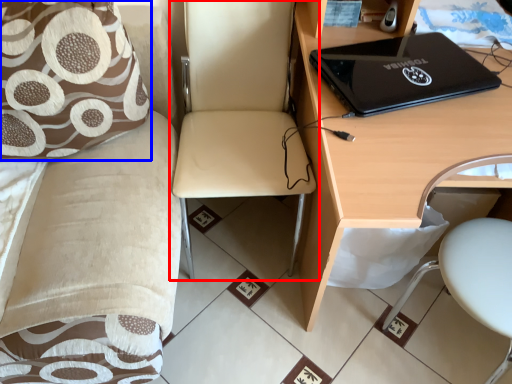
Question: Which point is closer to the camera, chair (highlighted by a red box) or pillow (highlighted by a blue box)?

Choices:
 (A) chair
 (B) pillow

Answer: (A)